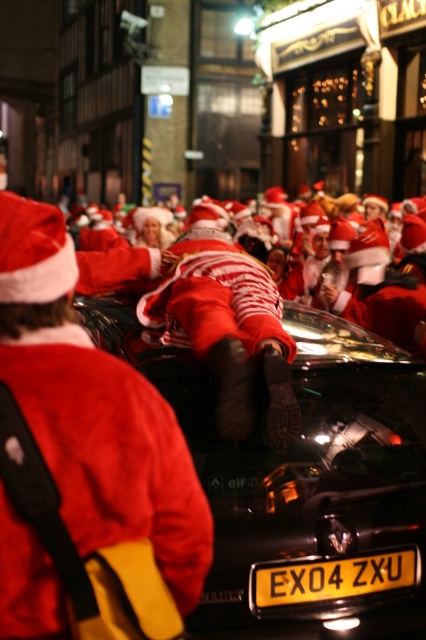
Between point (112, 332) and point (157, 301), which one is positioned behind?

Positioned behind is point (157, 301).

Can you confirm if shiny black car at center is positioned to the left of shiny red santa at center?

In fact, shiny black car at center is to the right of shiny red santa at center.

Is point (253, 458) in front of point (247, 419)?

No, it is behind (247, 419).

What are the coordinates of `shiny black car at center` in the screenshot? It's located at (304, 483).

Is fuzzy red santa at center above yellow metallic license plate at center?

Yes.

Who is more forward, (199, 573) or (345, 564)?

Positioned in front is point (199, 573).

This screenshot has height=640, width=426. Describe the element at coordinates (111, 451) in the screenshot. I see `fuzzy red santa at center` at that location.

Find the location of a particular element. This screenshot has height=640, width=426. fuzzy red santa at center is located at coordinates (111, 451).

Is the position of fuzzy red santa at center less distant than that of shiny red santa at center?

Yes, it is.

Who is lower down, fuzzy red santa at center or shiny red santa at center?

fuzzy red santa at center

Where is `fuzzy red santa at center`? fuzzy red santa at center is located at coordinates coord(111,451).